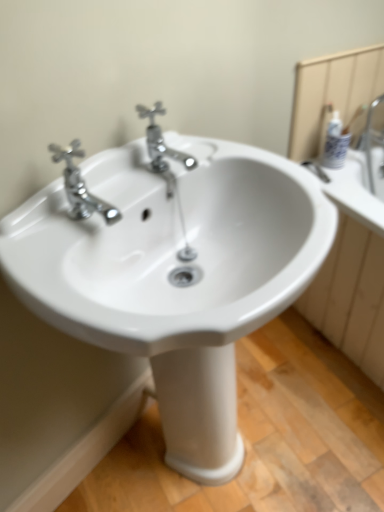
In order to face chrome/metallic faucet at center, the 2th tap positioned from the left, should I rotate leftwards or rightwards?

You should look left and rotate roughly 4.560 degrees.

How much space does chrome/metallic faucet at center, positioned as the 1th tap in right-to-left order, occupy vertically?

chrome/metallic faucet at center, positioned as the 1th tap in right-to-left order, is 4.80 inches tall.

Find the location of `chrome metallic faucet at upper left, the 2th tap when ordered from right to left`. chrome metallic faucet at upper left, the 2th tap when ordered from right to left is located at coordinates (80, 186).

Is white glossy sink at center to the left or to the right of white glossy mirror at upper right in the image?

Clearly, white glossy sink at center is on the left of white glossy mirror at upper right in the image.

Is white glossy sink at center taller or shorter than white glossy mirror at upper right?

Clearly, white glossy sink at center is taller compared to white glossy mirror at upper right.

Considering the relative sizes of white glossy sink at center and white glossy mirror at upper right in the image provided, is white glossy sink at center smaller than white glossy mirror at upper right?

Incorrect, white glossy sink at center is not smaller in size than white glossy mirror at upper right.

Would you say white glossy sink at center contains white glossy mirror at upper right?

No, white glossy mirror at upper right is not a part of white glossy sink at center.

Is chrome/metallic faucet at center, positioned as the 1th tap in right-to-left order, completely or partially outside of chrome metallic faucet at upper left, the 2th tap when ordered from right to left?

Indeed, chrome/metallic faucet at center, positioned as the 1th tap in right-to-left order, is completely outside chrome metallic faucet at upper left, the 2th tap when ordered from right to left.

Which object is more forward, chrome/metallic faucet at center, the 2th tap positioned from the left, or chrome metallic faucet at upper left, the first tap from the left?

chrome metallic faucet at upper left, the first tap from the left, is in front.

Based on the photo, from a real-world perspective, is chrome/metallic faucet at center, positioned as the 1th tap in right-to-left order, positioned above or below chrome metallic faucet at upper left, the first tap from the left?

chrome/metallic faucet at center, positioned as the 1th tap in right-to-left order, is below chrome metallic faucet at upper left, the first tap from the left.

Does chrome/metallic faucet at center, positioned as the 1th tap in right-to-left order, turn towards chrome metallic faucet at upper left, the first tap from the left?

No, chrome/metallic faucet at center, positioned as the 1th tap in right-to-left order, is not facing towards chrome metallic faucet at upper left, the first tap from the left.

How many degrees apart are the facing directions of chrome/metallic faucet at center, the 2th tap positioned from the left, and white glossy mirror at upper right?

There is a 20.8-degree angle between the facing directions of chrome/metallic faucet at center, the 2th tap positioned from the left, and white glossy mirror at upper right.

Does chrome/metallic faucet at center, the 2th tap positioned from the left, have a lesser width compared to white glossy mirror at upper right?

No.

From the image's perspective, between chrome/metallic faucet at center, the 2th tap positioned from the left, and white glossy mirror at upper right, which one is located above?

From the image's view, white glossy mirror at upper right is above.

From a real-world perspective, between chrome/metallic faucet at center, the 2th tap positioned from the left, and white glossy mirror at upper right, who is vertically lower?

white glossy mirror at upper right, from a real-world perspective.

Is white glossy mirror at upper right further to camera compared to chrome/metallic faucet at center, the 2th tap positioned from the left?

Yes, it is behind chrome/metallic faucet at center, the 2th tap positioned from the left.

Considering the sizes of white glossy mirror at upper right and chrome/metallic faucet at center, the 2th tap positioned from the left, in the image, is white glossy mirror at upper right wider or thinner than chrome/metallic faucet at center, the 2th tap positioned from the left,?

Clearly, white glossy mirror at upper right has less width compared to chrome/metallic faucet at center, the 2th tap positioned from the left.

Consider the image. Who is taller, white glossy mirror at upper right or chrome/metallic faucet at center, positioned as the 1th tap in right-to-left order?

With more height is white glossy mirror at upper right.

I want to click on mirror behind the chrome/metallic faucet at center, the 2th tap positioned from the left, so click(x=332, y=93).

Does chrome/metallic faucet at center, the 2th tap positioned from the left, have a greater height compared to white glossy sink at center?

No, chrome/metallic faucet at center, the 2th tap positioned from the left, is not taller than white glossy sink at center.

From the image's perspective, starting from the white glossy sink at center, which tap is the 2nd one above? Please provide its 2D coordinates.

[(161, 142)]

Based on the photo, which object is positioned more to the right, chrome/metallic faucet at center, the 2th tap positioned from the left, or white glossy sink at center?

From the viewer's perspective, white glossy sink at center appears more on the right side.

From the image's perspective, which one is positioned lower, chrome/metallic faucet at center, the 2th tap positioned from the left, or white glossy sink at center?

white glossy sink at center is shown below in the image.

Could you measure the distance between chrome metallic faucet at upper left, the 2th tap when ordered from right to left, and chrome/metallic faucet at center, the 2th tap positioned from the left?

They are 6.91 inches apart.

Is chrome metallic faucet at upper left, the first tap from the left, to the left of chrome/metallic faucet at center, the 2th tap positioned from the left, from the viewer's perspective?

Yes, chrome metallic faucet at upper left, the first tap from the left, is to the left of chrome/metallic faucet at center, the 2th tap positioned from the left.

Where is `tap lying above the chrome metallic faucet at upper left, the 2th tap when ordered from right to left (from the image's perspective)`? tap lying above the chrome metallic faucet at upper left, the 2th tap when ordered from right to left (from the image's perspective) is located at coordinates (161, 142).

Can you tell me how much chrome metallic faucet at upper left, the first tap from the left, and chrome/metallic faucet at center, positioned as the 1th tap in right-to-left order, differ in facing direction?

There is a 1.45-degree angle between the facing directions of chrome metallic faucet at upper left, the first tap from the left, and chrome/metallic faucet at center, positioned as the 1th tap in right-to-left order.

Can you confirm if white glossy mirror at upper right is bigger than white glossy sink at center?

No.

From a real-world perspective, between white glossy mirror at upper right and white glossy sink at center, who is vertically higher?

In real-world perspective, white glossy mirror at upper right is above.

Considering the sizes of white glossy mirror at upper right and white glossy sink at center in the image, is white glossy mirror at upper right taller or shorter than white glossy sink at center?

Considering their sizes, white glossy mirror at upper right has less height than white glossy sink at center.

Where is `sink that appears in front of the white glossy mirror at upper right`? The height and width of the screenshot is (512, 384). sink that appears in front of the white glossy mirror at upper right is located at coordinates (173, 272).

The width and height of the screenshot is (384, 512). Identify the location of sink to the left of white glossy mirror at upper right. (173, 272).

This screenshot has width=384, height=512. In the image, there is a chrome/metallic faucet at center, positioned as the 1th tap in right-to-left order. Find the location of `tap below it (from the image's perspective)`. tap below it (from the image's perspective) is located at coordinates (80, 186).

Based on the photo, which object lies further to the anchor point white glossy mirror at upper right, white glossy sink at center or chrome metallic faucet at upper left, the first tap from the left?

Among the two, chrome metallic faucet at upper left, the first tap from the left, is located further to white glossy mirror at upper right.

Estimate the real-world distances between objects in this image. Which object is closer to white glossy mirror at upper right, chrome/metallic faucet at center, the 2th tap positioned from the left, or chrome metallic faucet at upper left, the 2th tap when ordered from right to left?

Based on the image, chrome/metallic faucet at center, the 2th tap positioned from the left, appears to be nearer to white glossy mirror at upper right.

Based on their spatial positions, is white glossy mirror at upper right or chrome/metallic faucet at center, the 2th tap positioned from the left, further from chrome metallic faucet at upper left, the 2th tap when ordered from right to left?

white glossy mirror at upper right is positioned further to the anchor chrome metallic faucet at upper left, the 2th tap when ordered from right to left.

Based on their spatial positions, is chrome/metallic faucet at center, positioned as the 1th tap in right-to-left order, or white glossy sink at center further from white glossy mirror at upper right?

The object further to white glossy mirror at upper right is white glossy sink at center.

Which object lies further to the anchor point chrome metallic faucet at upper left, the 2th tap when ordered from right to left, white glossy sink at center or white glossy mirror at upper right?

white glossy mirror at upper right is further to chrome metallic faucet at upper left, the 2th tap when ordered from right to left.

From the image, which object appears to be nearer to white glossy sink at center, chrome/metallic faucet at center, positioned as the 1th tap in right-to-left order, or chrome metallic faucet at upper left, the first tap from the left?

chrome metallic faucet at upper left, the first tap from the left, lies closer to white glossy sink at center than the other object.

From the picture: From the image, which object appears to be nearer to white glossy sink at center, white glossy mirror at upper right or chrome metallic faucet at upper left, the first tap from the left?

The object closer to white glossy sink at center is chrome metallic faucet at upper left, the first tap from the left.

Consider the image. Which object lies nearer to the anchor point white glossy sink at center, chrome/metallic faucet at center, the 2th tap positioned from the left, or white glossy mirror at upper right?

chrome/metallic faucet at center, the 2th tap positioned from the left, is closer to white glossy sink at center.

This screenshot has width=384, height=512. I want to click on tap between chrome/metallic faucet at center, positioned as the 1th tap in right-to-left order, and white glossy sink at center vertically, so tap(80, 186).

This screenshot has height=512, width=384. In order to click on tap situated between chrome metallic faucet at upper left, the first tap from the left, and white glossy mirror at upper right from left to right in this screenshot , I will do `click(161, 142)`.